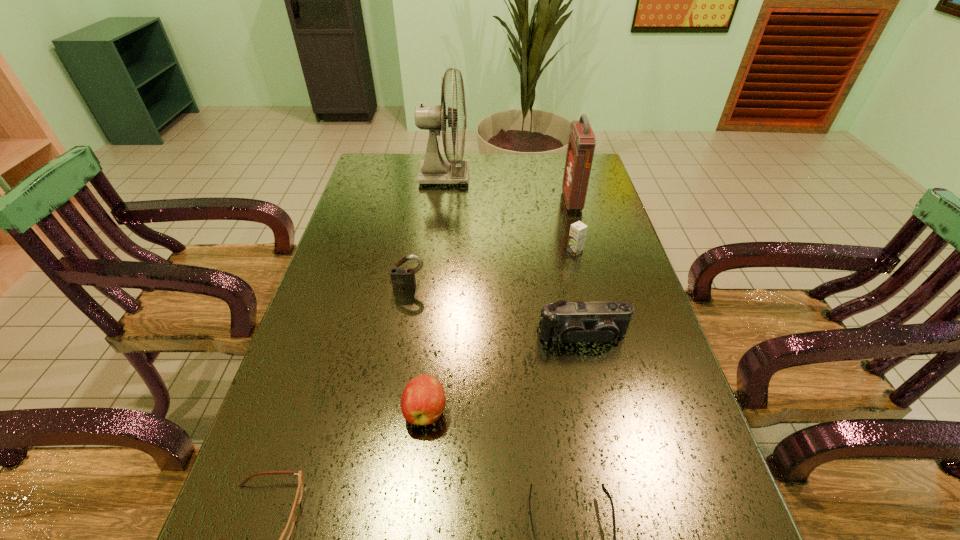
Identify which object is the nearest to the seventh tallest object. Please provide its 2D coordinates. Your answer should be formatted as a tuple, i.e. [(x, y)], where the tuple contains the x and y coordinates of a point satisfying the conditions above.

[(423, 400)]

Locate which object is the fourth closest to the spectacles. Please provide its 2D coordinates. Your answer should be formatted as a tuple, i.e. [(x, y)], where the tuple contains the x and y coordinates of a point satisfying the conditions above.

[(603, 322)]

Where is `vacant area in the image that satisfies the following two spatial constraints: 1. on the front-facing side of the fan; 2. on the right side of the chocolate milk`? vacant area in the image that satisfies the following two spatial constraints: 1. on the front-facing side of the fan; 2. on the right side of the chocolate milk is located at coordinates (436, 252).

I want to click on free space in the image that satisfies the following two spatial constraints: 1. on the front-facing side of the sixth farthest object; 2. on the right side of the fan, so click(418, 411).

Locate an element on the screen. The image size is (960, 540). free space in the image that satisfies the following two spatial constraints: 1. with the keyhole on the front of the apple; 2. on the left side of the padlock is located at coordinates (390, 411).

The height and width of the screenshot is (540, 960). Identify the location of vacant space that satisfies the following two spatial constraints: 1. with the keyhole on the front of the apple; 2. on the right side of the padlock. (390, 411).

The height and width of the screenshot is (540, 960). I want to click on vacant space that satisfies the following two spatial constraints: 1. on the front-facing side of the second tallest object; 2. on the front-facing side of the camcorder, so click(609, 336).